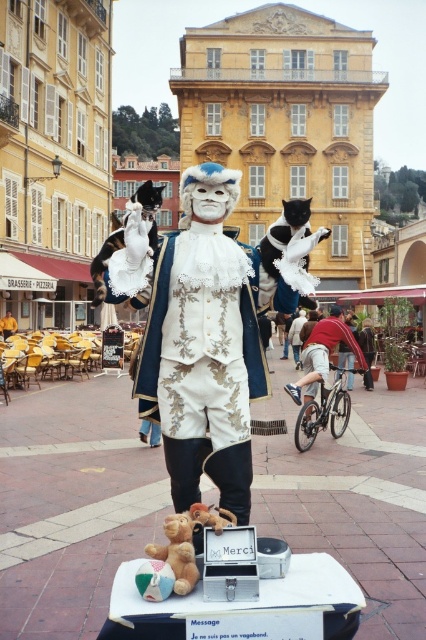
Does point (227, 294) come in front of point (264, 266)?

Yes, it is.

Is white lace fabric costume at center wider than black and white fur cat at center?

No.

Who is more distant from viewer, (172,285) or (282,252)?

The point (282,252) is behind.

Locate an element on the screen. The height and width of the screenshot is (640, 426). white lace fabric costume at center is located at coordinates (201, 396).

Describe the element at coordinates (201, 396) in the screenshot. I see `white lace fabric costume at center` at that location.

Does white lace fabric costume at center have a lesser width compared to red cotton shirt at center?

Yes, white lace fabric costume at center is thinner than red cotton shirt at center.

Image resolution: width=426 pixels, height=640 pixels. What are the coordinates of `white lace fabric costume at center` in the screenshot? It's located at (201, 396).

Which of these two, black and white fur cat at center or red cotton shirt at center, stands shorter?

Standing shorter between the two is red cotton shirt at center.

Describe the element at coordinates (291, 248) in the screenshot. I see `black and white fur cat at center` at that location.

Image resolution: width=426 pixels, height=640 pixels. What are the coordinates of `black and white fur cat at center` in the screenshot? It's located at (291, 248).